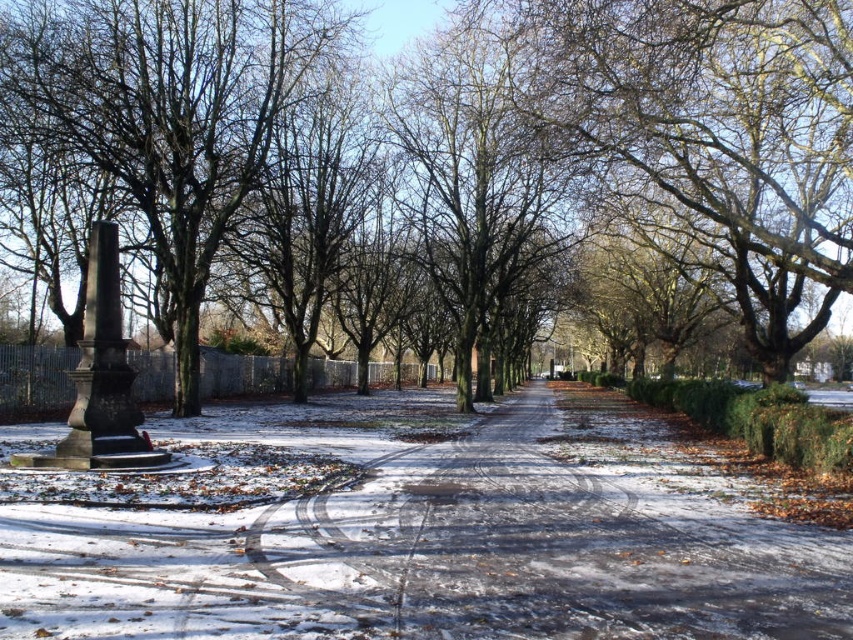
Can you confirm if snowy asphalt path at lower left is thinner than brown textured tree at center?

No, snowy asphalt path at lower left is not thinner than brown textured tree at center.

Who is more distant from viewer, (759, 579) or (471, 275)?

Positioned behind is point (471, 275).

This screenshot has height=640, width=853. Identify the location of snowy asphalt path at lower left. (421, 531).

Is point (560, 429) less distant than point (91, 48)?

That is False.

Is snowy asphalt path at lower left to the right of smooth brown tree at left from the viewer's perspective?

Indeed, snowy asphalt path at lower left is positioned on the right side of smooth brown tree at left.

Locate an element on the screen. snowy asphalt path at lower left is located at coordinates (421, 531).

Locate an element on the screen. snowy asphalt path at lower left is located at coordinates (421, 531).

Can you confirm if bare branches at center is positioned below brown textured tree at center?

No.

Can you confirm if bare branches at center is positioned to the right of brown textured tree at center?

Yes, bare branches at center is to the right of brown textured tree at center.

Which is in front, point (804, 83) or point (440, 172)?

Point (804, 83)

Where is `bare branches at center`? The image size is (853, 640). bare branches at center is located at coordinates (706, 109).